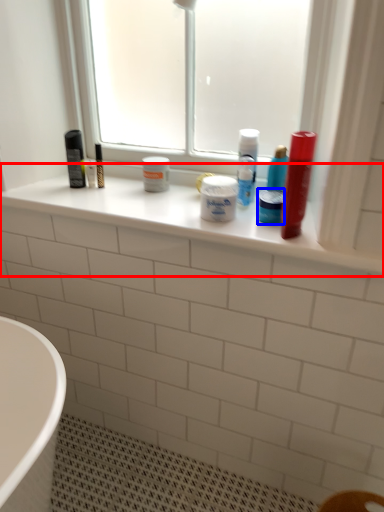
Question: Which of the following is the farthest to the observer, window sill (highlighted by a red box) or mouthwash (highlighted by a blue box)?

Choices:
 (A) window sill
 (B) mouthwash

Answer: (B)